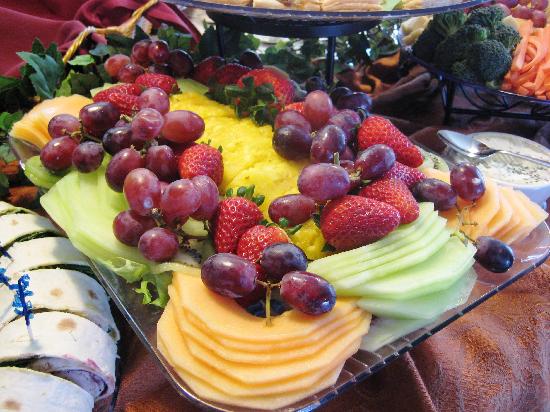
The width and height of the screenshot is (550, 412). Find the location of `glass platter`. glass platter is located at coordinates (374, 360).